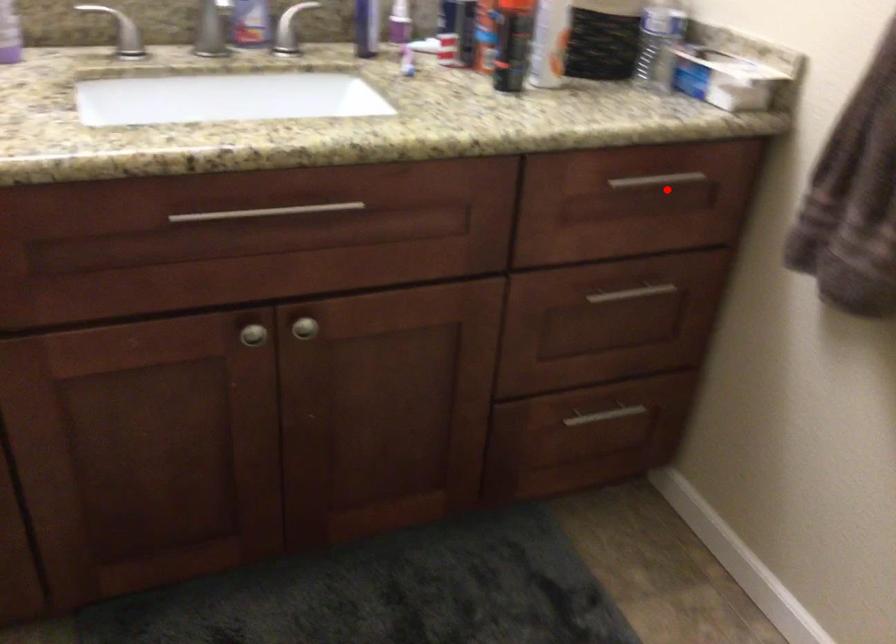
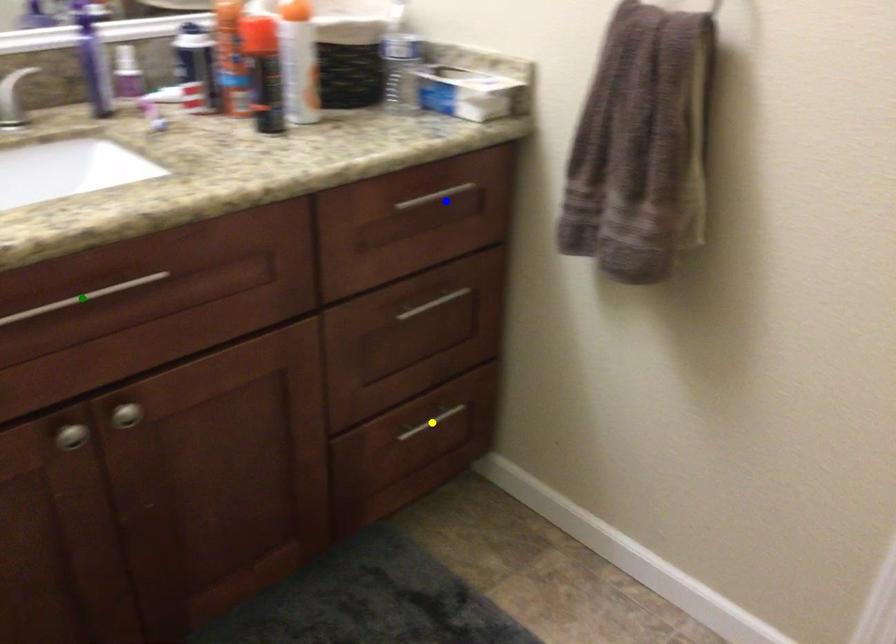
Question: I am providing you with two images of the same scene from different viewpoints. A red point is marked on the first image. You are given multiple points on the second image. Which point in image 2 represents the same 3d spot as the red point in image 1?

Choices:
 (A) yellow point
 (B) green point
 (C) blue point

Answer: (C)